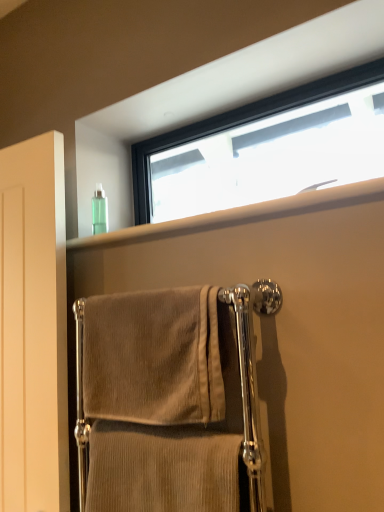
Question: Is the position of clear plastic bottle at upper center less distant than that of green translucent bottle at upper left?

Choices:
 (A) yes
 (B) no

Answer: (A)

Question: Considering the relative sizes of clear plastic bottle at upper center and green translucent bottle at upper left in the image provided, is clear plastic bottle at upper center shorter than green translucent bottle at upper left?

Choices:
 (A) yes
 (B) no

Answer: (A)

Question: Is clear plastic bottle at upper center thinner than green translucent bottle at upper left?

Choices:
 (A) no
 (B) yes

Answer: (A)

Question: Is clear plastic bottle at upper center far from green translucent bottle at upper left?

Choices:
 (A) no
 (B) yes

Answer: (A)

Question: Considering the relative positions of clear plastic bottle at upper center and green translucent bottle at upper left in the image provided, is clear plastic bottle at upper center to the right of green translucent bottle at upper left from the viewer's perspective?

Choices:
 (A) no
 (B) yes

Answer: (B)

Question: Can we say clear plastic bottle at upper center lies outside green translucent bottle at upper left?

Choices:
 (A) no
 (B) yes

Answer: (B)

Question: Does black frame window at upper center have a lesser height compared to beige corduroy towel at center, the first towel when ordered from bottom to top?

Choices:
 (A) no
 (B) yes

Answer: (A)

Question: Considering the relative sizes of black frame window at upper center and beige corduroy towel at center, the second towel from the top, in the image provided, is black frame window at upper center smaller than beige corduroy towel at center, the second towel from the top,?

Choices:
 (A) no
 (B) yes

Answer: (B)

Question: Is black frame window at upper center outside of beige corduroy towel at center, the first towel when ordered from bottom to top?

Choices:
 (A) yes
 (B) no

Answer: (A)

Question: Is black frame window at upper center not near beige corduroy towel at center, the second towel from the top?

Choices:
 (A) yes
 (B) no

Answer: (B)

Question: Does black frame window at upper center have a greater width compared to beige corduroy towel at center, the first towel when ordered from bottom to top?

Choices:
 (A) yes
 (B) no

Answer: (B)

Question: From the image's perspective, does black frame window at upper center appear higher than beige corduroy towel at center, the second towel from the top?

Choices:
 (A) yes
 (B) no

Answer: (A)

Question: From the image's perspective, would you say clear plastic bottle at upper center is shown under black frame window at upper center?

Choices:
 (A) yes
 (B) no

Answer: (A)